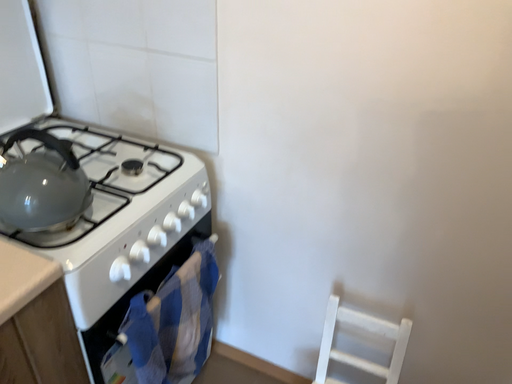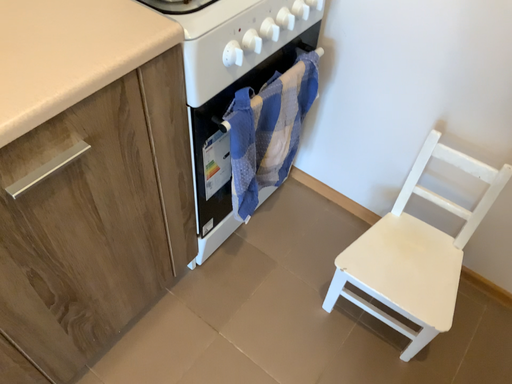
Question: How did the camera likely rotate when shooting the video?

Choices:
 (A) rotated right
 (B) rotated left

Answer: (B)